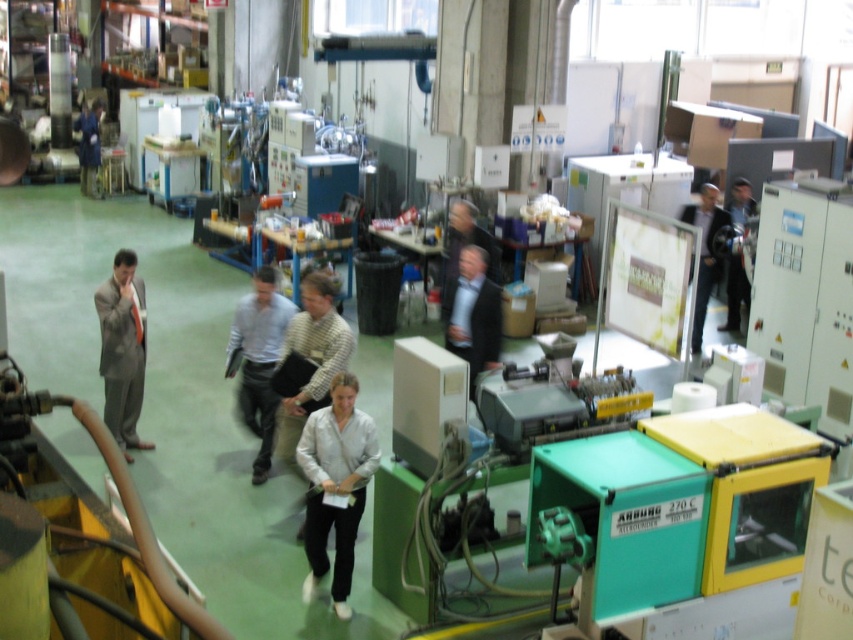
You are a tour guide leading a group through the factory. You notice two people in the center area wearing a white matte shirt at center and a dark blue suit at center. Which one is standing to the left of the other?

The white matte shirt at center is positioned on the left side of dark blue suit at center, so the person wearing the white matte shirt at center is standing to the left of the person in the dark blue suit at center.

From the picture: You are a tour guide leading a group in the factory. You notice two visitors wearing a light blue shirt at center and a dark blue suit at center. If you want to ensure both visitors can hear you clearly, how far apart are they standing from each other?

The light blue shirt at center is 5.72 feet away from dark blue suit at center, so they are standing approximately 5.72 feet apart from each other.